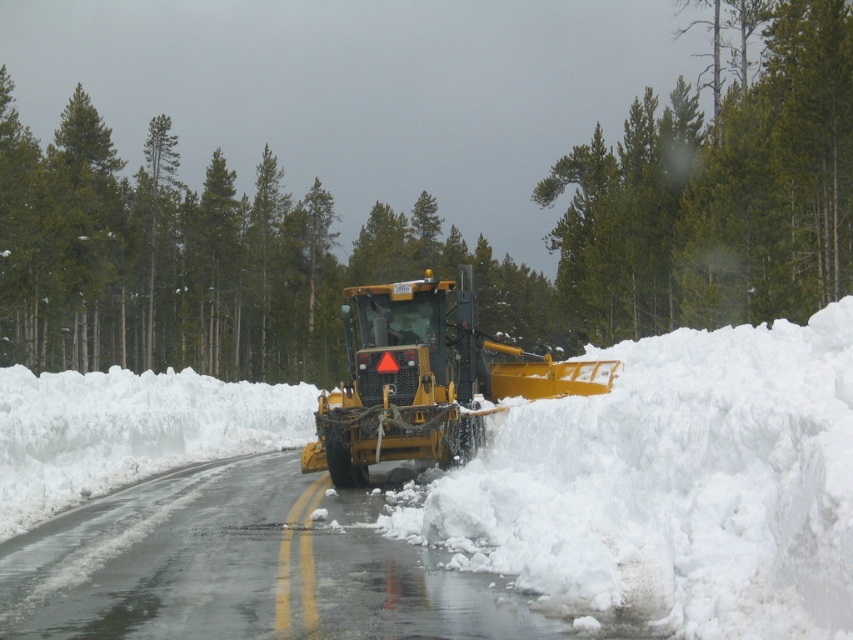
Is the position of green textured pine at upper center more distant than that of yellow metallic plow at center?

Yes, it is.

Who is shorter, green textured pine at upper center or yellow metallic plow at center?

yellow metallic plow at center is shorter.

At what (x,y) coordinates should I click in order to perform the action: click on green textured pine at upper center. Please return your answer as a coordinate pair (x, y). The image size is (853, 640). Looking at the image, I should click on (717, 195).

Does green textured pine at center have a lesser width compared to yellow metallic plow at center?

No.

Is green textured pine at center wider than yellow metallic plow at center?

Yes, green textured pine at center is wider than yellow metallic plow at center.

Is point (62, 314) farther from viewer compared to point (456, 337)?

Yes, point (62, 314) is farther from viewer.

Image resolution: width=853 pixels, height=640 pixels. I want to click on green textured pine at center, so click(x=440, y=227).

Which is in front, point (659, 99) or point (90, 584)?

Positioned in front is point (90, 584).

Can you confirm if green textured pine at center is thinner than yellow rubber snowplow at center?

No.

Between point (215, 189) and point (280, 552), which one is positioned behind?

The point (215, 189) is more distant.

The width and height of the screenshot is (853, 640). I want to click on green textured pine at center, so click(440, 227).